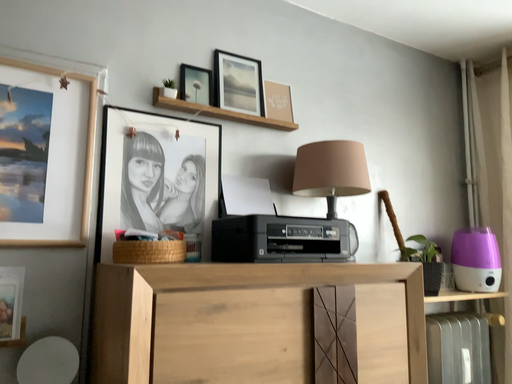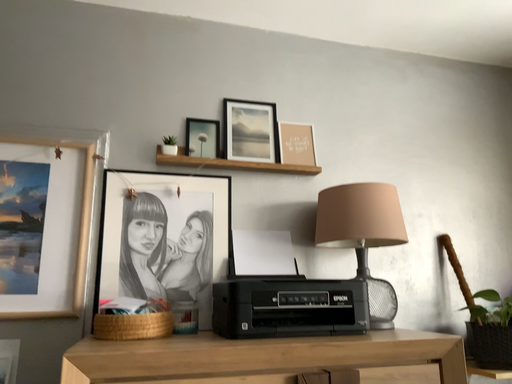
Question: How did the camera likely rotate when shooting the video?

Choices:
 (A) rotated left
 (B) rotated right

Answer: (A)